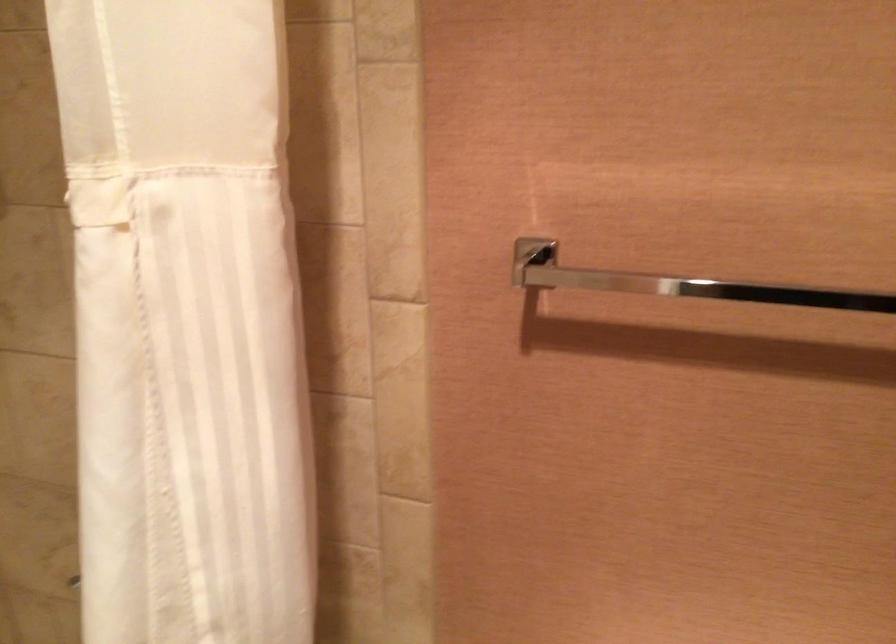
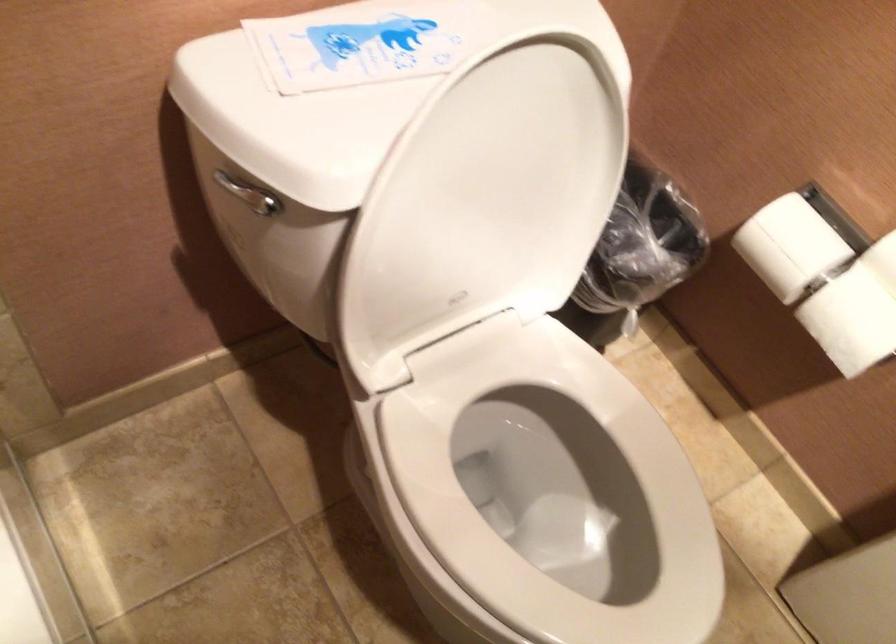
How did the camera likely rotate?

The rotation direction of the camera is right-down.